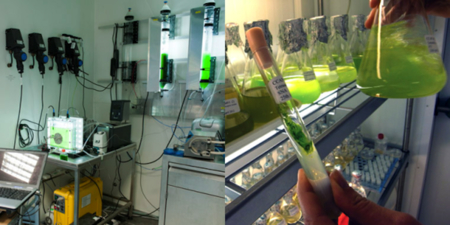
In order to click on refrigerator door in this screenshot , I will do `click(424, 122)`.